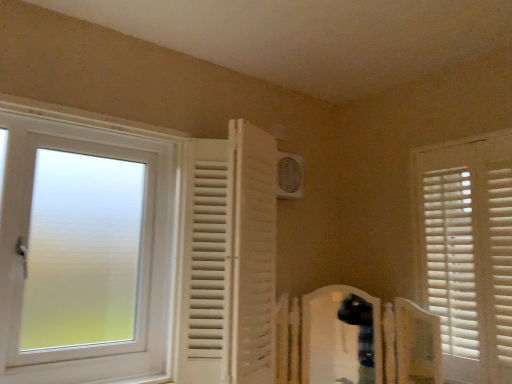
Question: From a real-world perspective, does white frosted glass window at left, the 1th window from the left, sit lower than white plastic air conditioning unit at upper center?

Choices:
 (A) no
 (B) yes

Answer: (B)

Question: Does white frosted glass window at left, the 1th window from the left, have a lesser width compared to white plastic air conditioning unit at upper center?

Choices:
 (A) no
 (B) yes

Answer: (A)

Question: Considering the relative sizes of white frosted glass window at left, which is the second window in right-to-left order, and white plastic air conditioning unit at upper center in the image provided, is white frosted glass window at left, which is the second window in right-to-left order, wider than white plastic air conditioning unit at upper center?

Choices:
 (A) no
 (B) yes

Answer: (B)

Question: Considering the relative positions of white frosted glass window at left, the 1th window from the left, and white plastic air conditioning unit at upper center in the image provided, is white frosted glass window at left, the 1th window from the left, behind white plastic air conditioning unit at upper center?

Choices:
 (A) no
 (B) yes

Answer: (A)

Question: From a real-world perspective, relative to white plastic air conditioning unit at upper center, is white frosted glass window at left, which is the second window in right-to-left order, vertically above or below?

Choices:
 (A) below
 (B) above

Answer: (A)

Question: From the image's perspective, relative to white plastic air conditioning unit at upper center, is white frosted glass window at left, which is the second window in right-to-left order, above or below?

Choices:
 (A) below
 (B) above

Answer: (A)

Question: Is point (238, 375) closer or farther from the camera than point (281, 167)?

Choices:
 (A) farther
 (B) closer

Answer: (B)

Question: Visually, is white frosted glass window at left, which is the second window in right-to-left order, positioned to the left or to the right of white plastic air conditioning unit at upper center?

Choices:
 (A) right
 (B) left

Answer: (B)

Question: Considering their positions, is white plastic air conditioning unit at upper center located in front of or behind white frosted glass window at left, the 1th window from the left?

Choices:
 (A) front
 (B) behind

Answer: (B)

Question: In terms of width, does white plastic air conditioning unit at upper center look wider or thinner when compared to white frosted glass window at left, the 1th window from the left?

Choices:
 (A) thin
 (B) wide

Answer: (A)

Question: From a real-world perspective, is white plastic air conditioning unit at upper center above or below white frosted glass window at left, which is the second window in right-to-left order?

Choices:
 (A) below
 (B) above

Answer: (B)

Question: Is white plastic air conditioning unit at upper center spatially inside white frosted glass window at left, which is the second window in right-to-left order, or outside of it?

Choices:
 (A) inside
 (B) outside

Answer: (B)

Question: From the image's perspective, is white wooden blinds at right, which is the first window from right to left, positioned above or below white frosted glass window at left, the 1th window from the left?

Choices:
 (A) above
 (B) below

Answer: (B)

Question: In the image, is white wooden blinds at right, which ranks as the second window in left-to-right order, positioned in front of or behind white frosted glass window at left, the 1th window from the left?

Choices:
 (A) front
 (B) behind

Answer: (B)